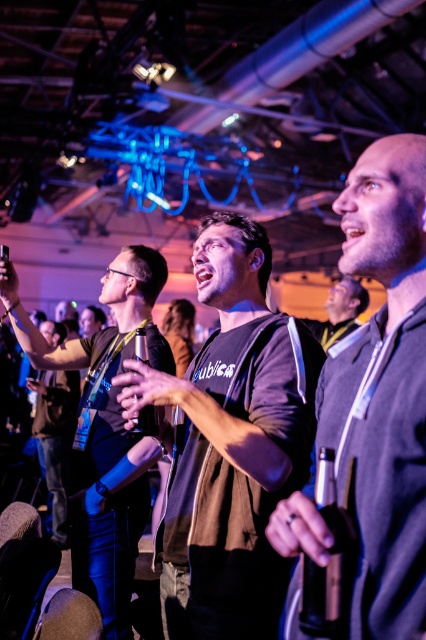
What do you see at coordinates (55, 438) in the screenshot? I see `black fabric shirt at center` at bounding box center [55, 438].

Does black fabric shirt at center have a greater height compared to dark gray hoodie at center?

Yes.

Locate an element on the screen. black fabric shirt at center is located at coordinates (55, 438).

Which of these two, dark gray t-shirt at center or dark gray fleece at center, stands taller?

Standing taller between the two is dark gray t-shirt at center.

Who is lower down, dark gray t-shirt at center or dark gray fleece at center?

dark gray t-shirt at center

At what (x,y) coordinates should I click in order to perform the action: click on dark gray t-shirt at center. Please return your answer as a coordinate pair (x, y). Looking at the image, I should click on (230, 442).

Who is more distant from viewer, (164,547) or (334,324)?

The point (334,324) is more distant.

Which is in front, point (256, 237) or point (365, 305)?

Point (256, 237) is in front.

Locate an element on the screen. This screenshot has height=640, width=426. dark gray t-shirt at center is located at coordinates (230, 442).